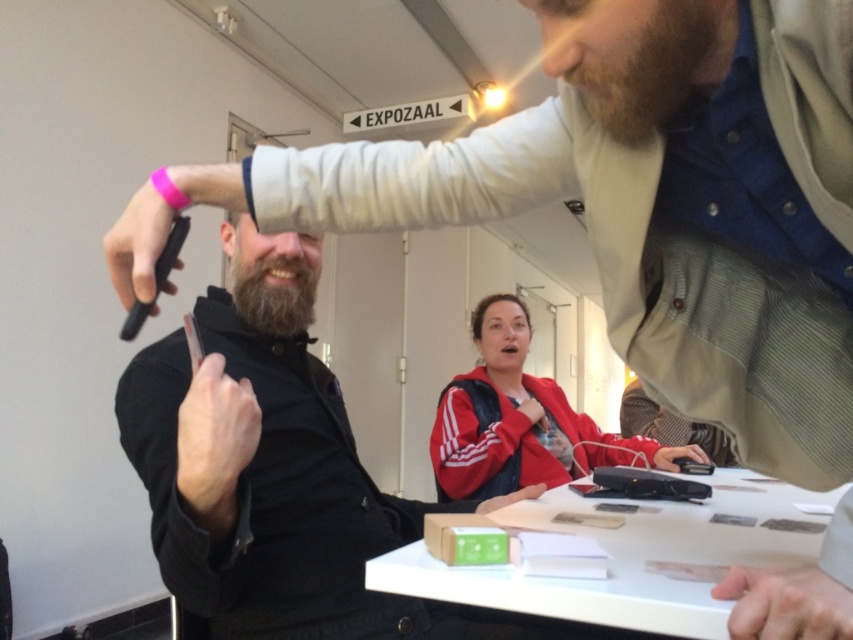
You are standing in the Exhibition Hall and see two points marked on the floor. The first point is at coordinates point [805,604] and the second is at point [177,234]. If you want to walk towards the point that is closer to the entrance of the hall, which point should you head towards?

Point [177,234] is closer to the entrance because it is behind point [805,604], which is in front of it. Since the entrance is typically at the back of such spaces, the point further back would be nearer to the entrance.

You are standing in the EXPOZAAL hallway and see the black matte jacket at center and the smooth black hand at center. Which object is positioned to the right of the other?

The black matte jacket at center is to the right of the smooth black hand at center.